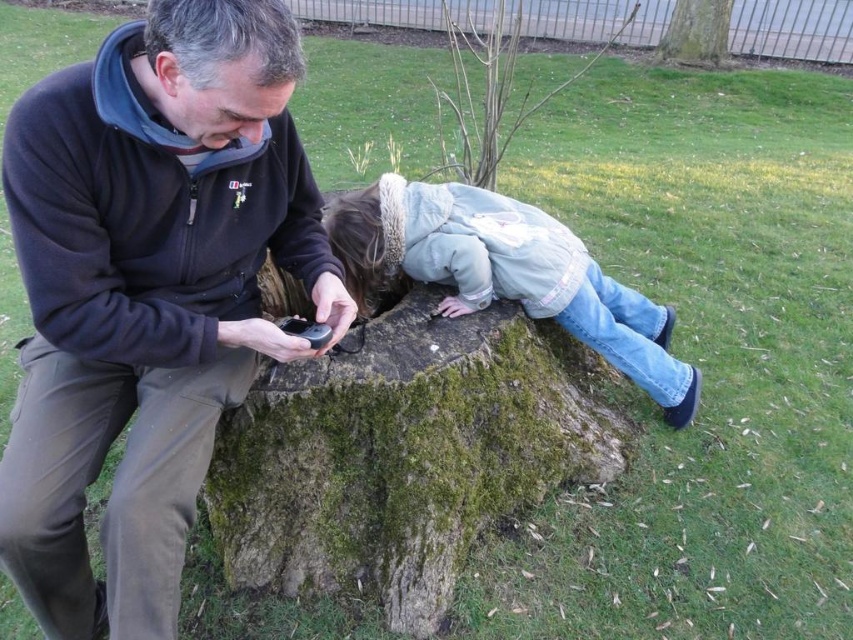
Question: From the image, what is the correct spatial relationship of green mossy stump at center in relation to light blue denim jeans at center?

Choices:
 (A) left
 (B) right

Answer: (A)

Question: Which of the following is the closest to the observer?

Choices:
 (A) green mossy stump at center
 (B) light blue denim jeans at center
 (C) dark blue fleece at upper left

Answer: (C)

Question: Which point is farther to the camera?

Choices:
 (A) green mossy stump at center
 (B) dark blue fleece at upper left
 (C) light blue denim jeans at center

Answer: (C)

Question: Considering the relative positions of dark blue fleece at upper left and brown rough tree trunk at upper center in the image provided, where is dark blue fleece at upper left located with respect to brown rough tree trunk at upper center?

Choices:
 (A) above
 (B) below

Answer: (B)

Question: Observing the image, what is the correct spatial positioning of green mossy stump at center in reference to brown rough tree trunk at upper center?

Choices:
 (A) below
 (B) above

Answer: (A)

Question: Which of the following is the farthest from the observer?

Choices:
 (A) green mossy stump at center
 (B) dark blue fleece at upper left
 (C) light blue denim jeans at center
 (D) brown rough tree trunk at upper center

Answer: (D)